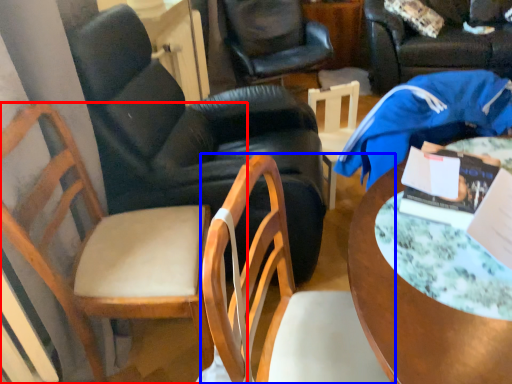
Question: Which object appears farthest to the camera in this image, chair (highlighted by a red box) or chair (highlighted by a blue box)?

Choices:
 (A) chair
 (B) chair

Answer: (A)